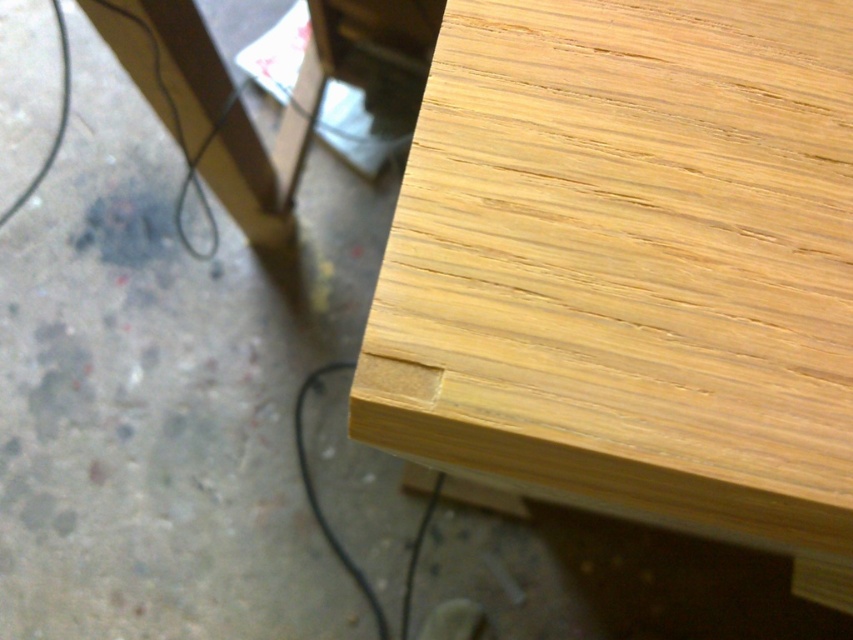
Question: Is natural wood table at upper right in front of black rubber wire at lower center?

Choices:
 (A) no
 (B) yes

Answer: (B)

Question: Which point is farther to the camera?

Choices:
 (A) (822, 381)
 (B) (407, 608)

Answer: (B)

Question: Is natural wood table at upper right positioned in front of black rubber wire at lower center?

Choices:
 (A) no
 (B) yes

Answer: (B)

Question: Which object appears closest to the camera in this image?

Choices:
 (A) black rubber wire at lower center
 (B) natural wood table at upper right

Answer: (B)

Question: Does natural wood table at upper right appear under black rubber wire at lower center?

Choices:
 (A) no
 (B) yes

Answer: (A)